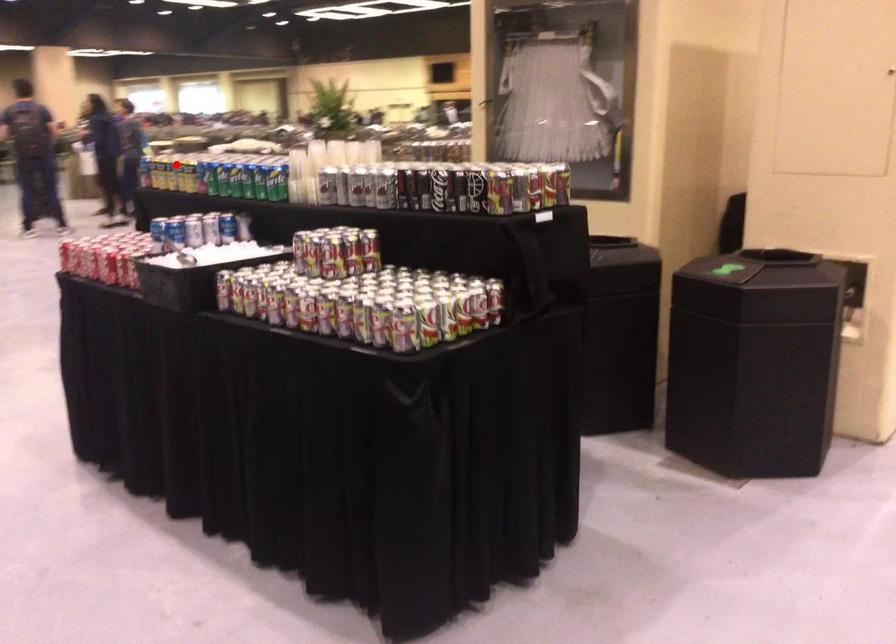
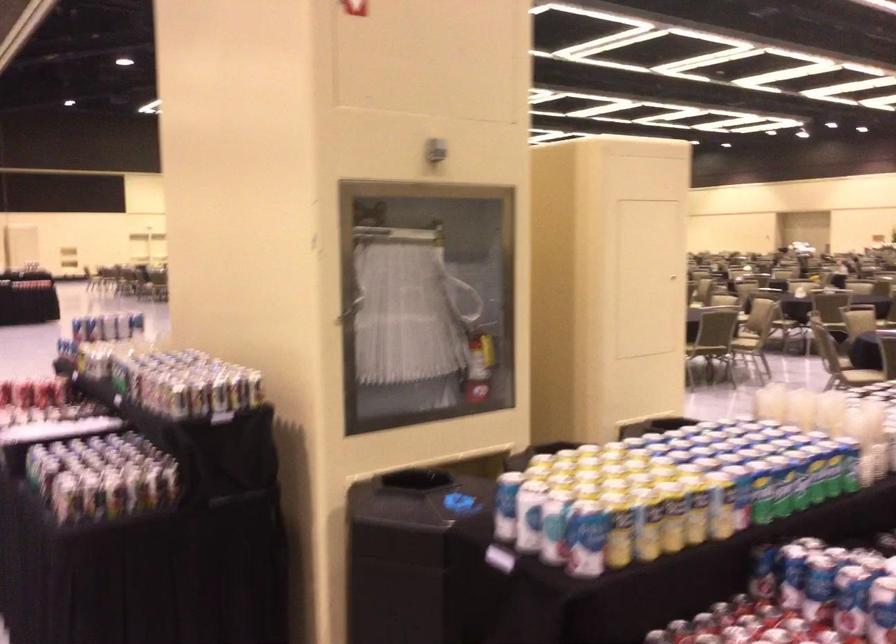
Question: I am providing you with two images of the same scene from different viewpoints. In image1, a red point is highlighted. Considering the same 3D point in image2, which of the following is correct?

Choices:
 (A) It is closer
 (B) It is farther

Answer: (A)